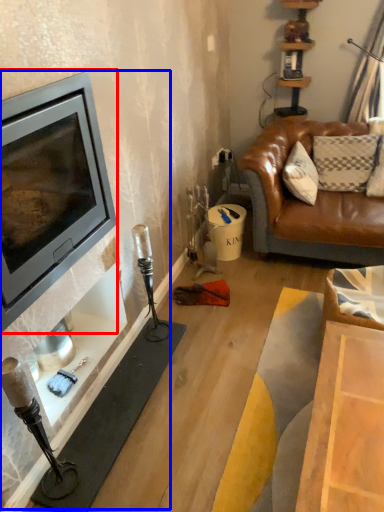
Question: Which point is closer to the camera, wood burning stove (highlighted by a red box) or fireplace (highlighted by a blue box)?

Choices:
 (A) wood burning stove
 (B) fireplace

Answer: (A)